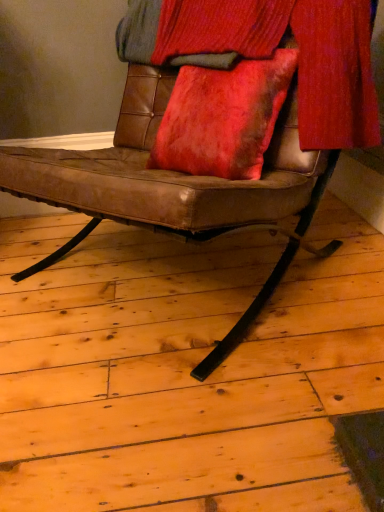
Question: Is brown leather chair at center to the left or to the right of velvet red curtain at upper center in the image?

Choices:
 (A) right
 (B) left

Answer: (B)

Question: Is point (84, 229) positioned closer to the camera than point (327, 121)?

Choices:
 (A) farther
 (B) closer

Answer: (A)

Question: Is brown leather chair at center inside or outside of velvet red curtain at upper center?

Choices:
 (A) outside
 (B) inside

Answer: (A)

Question: Considering the relative positions of velvet red curtain at upper center and brown leather chair at center in the image provided, is velvet red curtain at upper center to the left or to the right of brown leather chair at center?

Choices:
 (A) right
 (B) left

Answer: (A)

Question: From the image's perspective, relative to brown leather chair at center, is velvet red curtain at upper center above or below?

Choices:
 (A) above
 (B) below

Answer: (A)

Question: In terms of width, does velvet red curtain at upper center look wider or thinner when compared to brown leather chair at center?

Choices:
 (A) thin
 (B) wide

Answer: (A)

Question: From their relative heights in the image, would you say velvet red curtain at upper center is taller or shorter than brown leather chair at center?

Choices:
 (A) short
 (B) tall

Answer: (A)